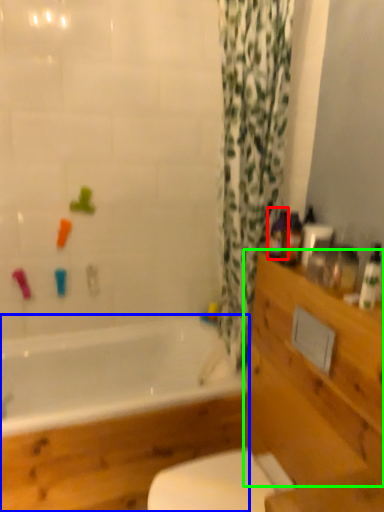
Question: Based on their relative distances, which object is farther from toiletry (highlighted by a red box)? Choose from bathtub (highlighted by a blue box) and drawer (highlighted by a green box).

Choices:
 (A) bathtub
 (B) drawer

Answer: (A)